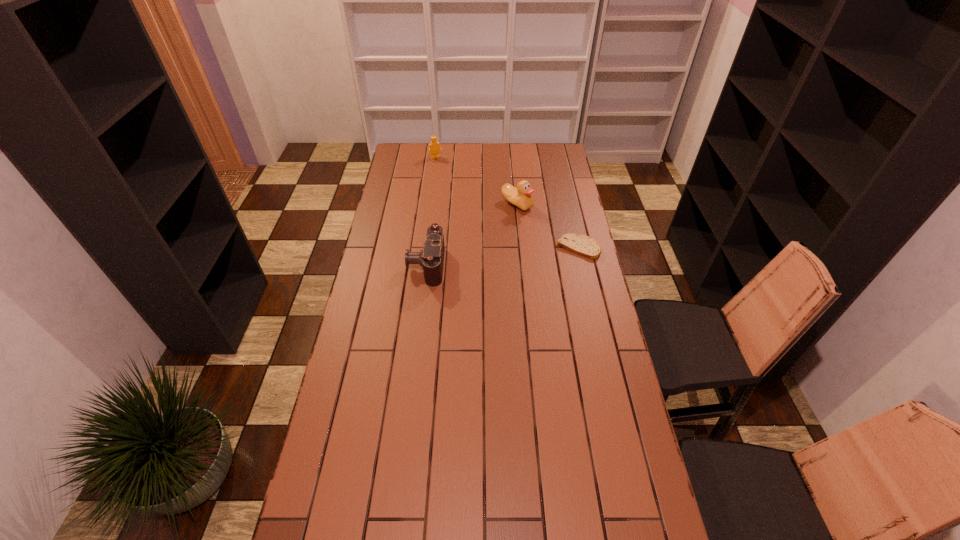
The width and height of the screenshot is (960, 540). I want to click on vacant space located on the face of the Lego, so click(448, 178).

Locate an element on the screen. This screenshot has height=540, width=960. blank space located at the beak of the duck is located at coordinates (518, 224).

Where is `free space located at the beak of the duck`? free space located at the beak of the duck is located at coordinates (519, 256).

The image size is (960, 540). What are the coordinates of `free spot located 0.090m at the beak of the duck` in the screenshot? It's located at (518, 227).

The height and width of the screenshot is (540, 960). What are the coordinates of `object that is at the far edge` in the screenshot? It's located at (434, 146).

Where is `object that is at the left edge`? This screenshot has height=540, width=960. object that is at the left edge is located at coordinates (431, 258).

Find the location of a particular element. The height and width of the screenshot is (540, 960). object that is at the right edge is located at coordinates (583, 245).

I want to click on free location at the far edge of the desktop, so click(483, 164).

Identify the location of free space at the near edge. The image size is (960, 540). (446, 509).

In the image, there is a desktop. Find the location of `blank space at the left edge`. blank space at the left edge is located at coordinates (389, 244).